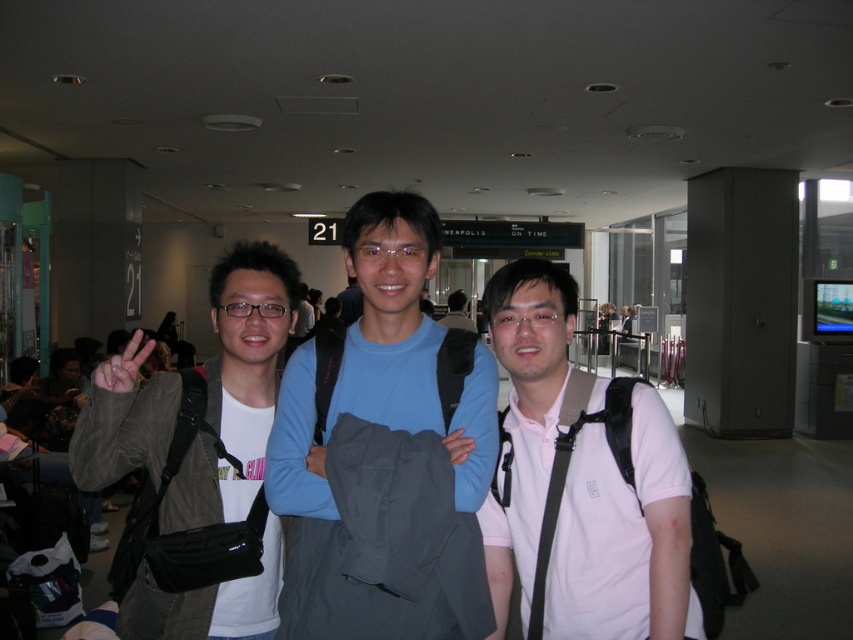
Question: Which point is closer to the camera?

Choices:
 (A) (189, 488)
 (B) (567, 515)
 (C) (405, 566)

Answer: (C)

Question: Is matte black jacket at left closer to the viewer compared to white matte shirt at center?

Choices:
 (A) yes
 (B) no

Answer: (A)

Question: Is matte black jacket at left wider than white matte shirt at center?

Choices:
 (A) yes
 (B) no

Answer: (B)

Question: Considering the real-world distances, which object is closest to the matte black jacket at left?

Choices:
 (A) white matte shirt at center
 (B) blue cotton shirt at center

Answer: (B)

Question: Can you confirm if blue cotton shirt at center is positioned to the right of matte black jacket at left?

Choices:
 (A) no
 (B) yes

Answer: (B)

Question: Which of the following is the closest to the observer?

Choices:
 (A) matte black jacket at left
 (B) blue cotton shirt at center
 (C) white matte shirt at center

Answer: (B)